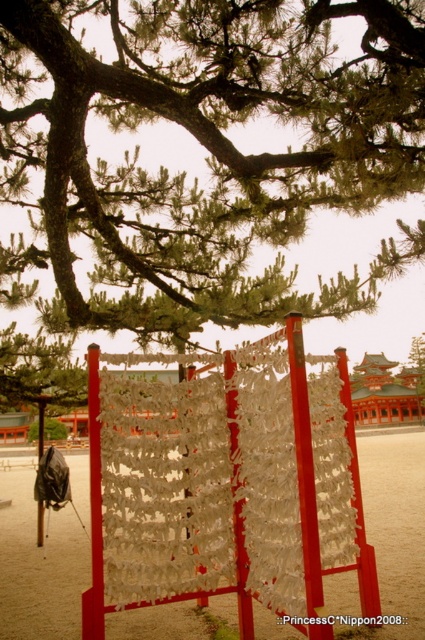
Between green leafy tree at upper center and sandy beige sand at lower center, which one appears on the right side from the viewer's perspective?

Positioned to the right is sandy beige sand at lower center.

Is point (393, 170) positioned before point (51, 598)?

Yes, point (393, 170) is closer to viewer.

You are a GUI agent. You are given a task and a screenshot of the screen. Output one action in this format:
    pyautogui.click(x=<x>, y=<y>)
    Task: Click on the green leafy tree at upper center
    The width and height of the screenshot is (425, 640).
    Given the screenshot: What is the action you would take?
    pyautogui.click(x=209, y=150)